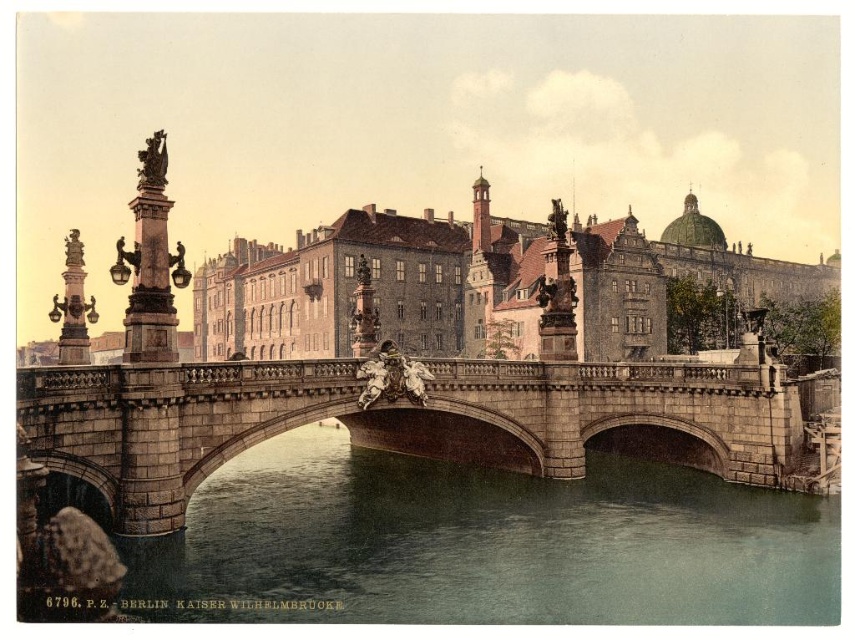
Question: Does greenish stone water at center appear on the right side of stone bridge at center?

Choices:
 (A) no
 (B) yes

Answer: (B)

Question: Does greenish stone water at center lie behind stone bridge at center?

Choices:
 (A) yes
 (B) no

Answer: (B)

Question: Which point is farther to the camera?

Choices:
 (A) greenish stone water at center
 (B) stone bridge at center

Answer: (B)

Question: Can you confirm if greenish stone water at center is positioned to the left of stone bridge at center?

Choices:
 (A) no
 (B) yes

Answer: (A)